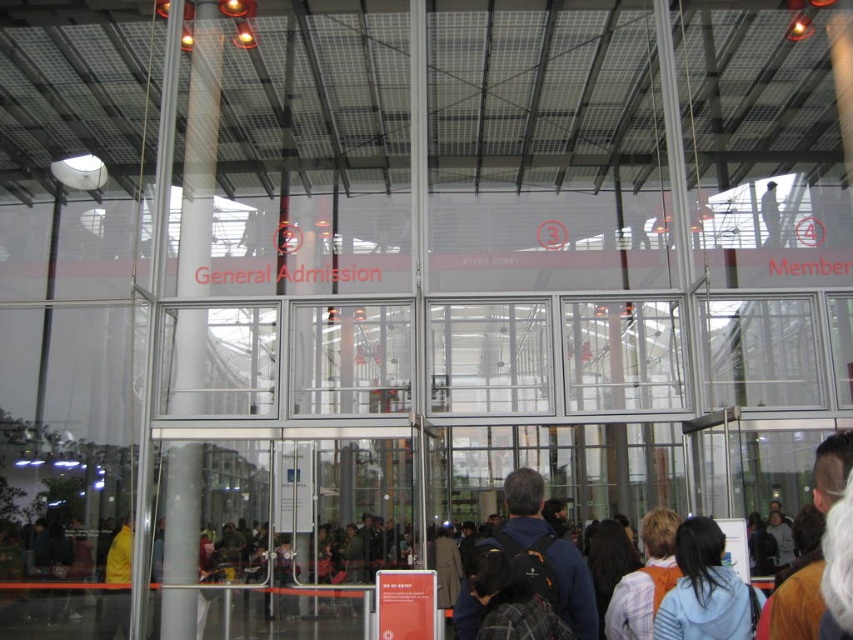
Question: Which object appears closest to the camera in this image?

Choices:
 (A) dark blue backpack at center
 (B) clear glass pillar at left
 (C) light blue hoodie at lower right

Answer: (C)

Question: Can you confirm if dark blue backpack at center is bigger than light blue hoodie at lower right?

Choices:
 (A) yes
 (B) no

Answer: (A)

Question: Does clear glass pillar at left have a lesser width compared to dark blue backpack at center?

Choices:
 (A) yes
 (B) no

Answer: (A)

Question: Among these points, which one is farthest from the camera?

Choices:
 (A) (204, 54)
 (B) (677, 628)

Answer: (A)

Question: Does clear glass pillar at left appear on the left side of light blue hoodie at lower right?

Choices:
 (A) no
 (B) yes

Answer: (B)

Question: Which point is closer to the camera?

Choices:
 (A) [720, 554]
 (B) [473, 637]
 (C) [187, 458]

Answer: (B)